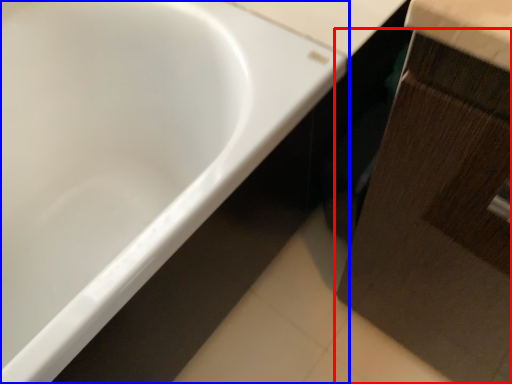
Question: Which object is further to the camera taking this photo, cabinetry (highlighted by a red box) or bathtub (highlighted by a blue box)?

Choices:
 (A) cabinetry
 (B) bathtub

Answer: (B)